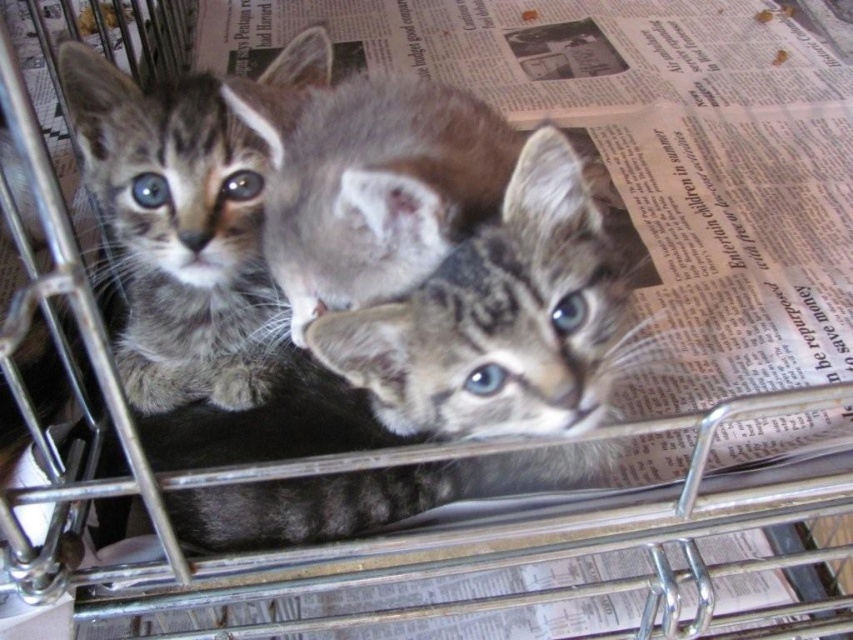
Question: Is gray tabby kitten at left above tabby fur kitten at center?

Choices:
 (A) no
 (B) yes

Answer: (B)

Question: Can you confirm if gray tabby kitten at left is thinner than gray fur kitten at center?

Choices:
 (A) no
 (B) yes

Answer: (B)

Question: Which of the following is the closest to the observer?

Choices:
 (A) gray tabby kitten at left
 (B) tabby fur kitten at center

Answer: (B)

Question: Does gray tabby kitten at left appear on the right side of gray fur kitten at center?

Choices:
 (A) yes
 (B) no

Answer: (B)

Question: Among these objects, which one is farthest from the camera?

Choices:
 (A) tabby fur kitten at center
 (B) gray tabby kitten at left
 (C) gray fur kitten at center

Answer: (B)

Question: Among these objects, which one is nearest to the camera?

Choices:
 (A) gray fur kitten at center
 (B) tabby fur kitten at center
 (C) gray tabby kitten at left

Answer: (A)